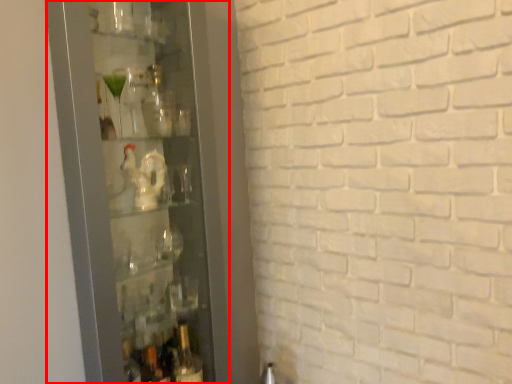
Question: From the image's perspective, what is the correct spatial relationship of glass door (annotated by the red box) in relation to bottle?

Choices:
 (A) above
 (B) below

Answer: (A)